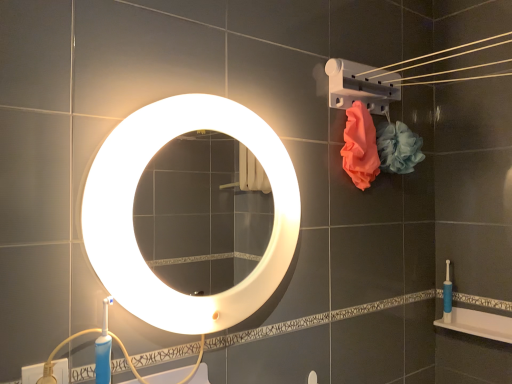
Question: Considering the relative sizes of matte orange towel at upper right, which ranks as the 2th flower in right-to-left order, and white glossy mirror at center in the image provided, is matte orange towel at upper right, which ranks as the 2th flower in right-to-left order, thinner than white glossy mirror at center?

Choices:
 (A) no
 (B) yes

Answer: (B)

Question: Can you see matte orange towel at upper right, placed as the 1th flower when sorted from left to right, touching white glossy mirror at center?

Choices:
 (A) yes
 (B) no

Answer: (B)

Question: Is matte orange towel at upper right, placed as the 1th flower when sorted from left to right, to the left of white glossy mirror at center from the viewer's perspective?

Choices:
 (A) no
 (B) yes

Answer: (A)

Question: Considering the relative sizes of matte orange towel at upper right, placed as the 1th flower when sorted from left to right, and white glossy mirror at center in the image provided, is matte orange towel at upper right, placed as the 1th flower when sorted from left to right, shorter than white glossy mirror at center?

Choices:
 (A) yes
 (B) no

Answer: (A)

Question: Considering the relative positions of matte orange towel at upper right, which ranks as the 2th flower in right-to-left order, and white glossy mirror at center in the image provided, is matte orange towel at upper right, which ranks as the 2th flower in right-to-left order, to the right of white glossy mirror at center from the viewer's perspective?

Choices:
 (A) no
 (B) yes

Answer: (B)

Question: From a real-world perspective, is white glossy bath at lower right physically located above or below matte orange towel at upper right, which ranks as the 2th flower in right-to-left order?

Choices:
 (A) below
 (B) above

Answer: (A)

Question: Is white glossy bath at lower right situated inside matte orange towel at upper right, which ranks as the 2th flower in right-to-left order, or outside?

Choices:
 (A) outside
 (B) inside

Answer: (A)

Question: In terms of size, does white glossy bath at lower right appear bigger or smaller than matte orange towel at upper right, placed as the 1th flower when sorted from left to right?

Choices:
 (A) small
 (B) big

Answer: (A)

Question: Considering the positions of white glossy bath at lower right and matte orange towel at upper right, placed as the 1th flower when sorted from left to right, in the image, is white glossy bath at lower right taller or shorter than matte orange towel at upper right, placed as the 1th flower when sorted from left to right,?

Choices:
 (A) tall
 (B) short

Answer: (B)

Question: Relative to soft pink mesh sponge at upper right, positioned as the 2th flower in left-to-right order, is matte orange towel at upper right, placed as the 1th flower when sorted from left to right, in front or behind?

Choices:
 (A) front
 (B) behind

Answer: (A)

Question: From a real-world perspective, is matte orange towel at upper right, placed as the 1th flower when sorted from left to right, physically located above or below soft pink mesh sponge at upper right, positioned as the 2th flower in left-to-right order?

Choices:
 (A) below
 (B) above

Answer: (A)

Question: Considering the positions of matte orange towel at upper right, placed as the 1th flower when sorted from left to right, and soft pink mesh sponge at upper right, positioned as the 2th flower in left-to-right order, in the image, is matte orange towel at upper right, placed as the 1th flower when sorted from left to right, taller or shorter than soft pink mesh sponge at upper right, positioned as the 2th flower in left-to-right order,?

Choices:
 (A) tall
 (B) short

Answer: (A)

Question: Looking at the image, does matte orange towel at upper right, which ranks as the 2th flower in right-to-left order, seem bigger or smaller compared to soft pink mesh sponge at upper right, positioned as the 2th flower in left-to-right order?

Choices:
 (A) small
 (B) big

Answer: (A)

Question: From a real-world perspective, is white glossy mirror at center positioned above or below matte orange towel at upper right, placed as the 1th flower when sorted from left to right?

Choices:
 (A) above
 (B) below

Answer: (B)

Question: From their relative heights in the image, would you say white glossy mirror at center is taller or shorter than matte orange towel at upper right, which ranks as the 2th flower in right-to-left order?

Choices:
 (A) tall
 (B) short

Answer: (A)